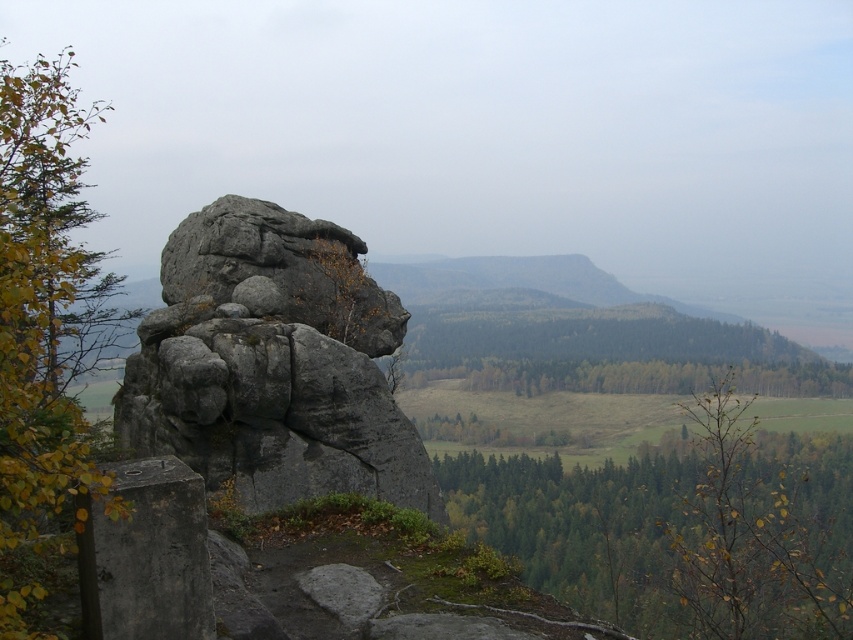
You are standing at the center of the image and looking towards the rocky outcrop. There is a point marked at coordinates point (44, 321). What color are the leaves located at that point?

The leaves at point (44, 321) are yellow and green.

You are standing at the base of the rocky outcrop and want to reach the highest point. There are two markers, point (x=273, y=369) and point (x=662, y=365). Which marker is closer to you?

Point (x=273, y=369) is closer to the viewer than point (x=662, y=365), so the marker at point (x=273, y=369) is closer to you.